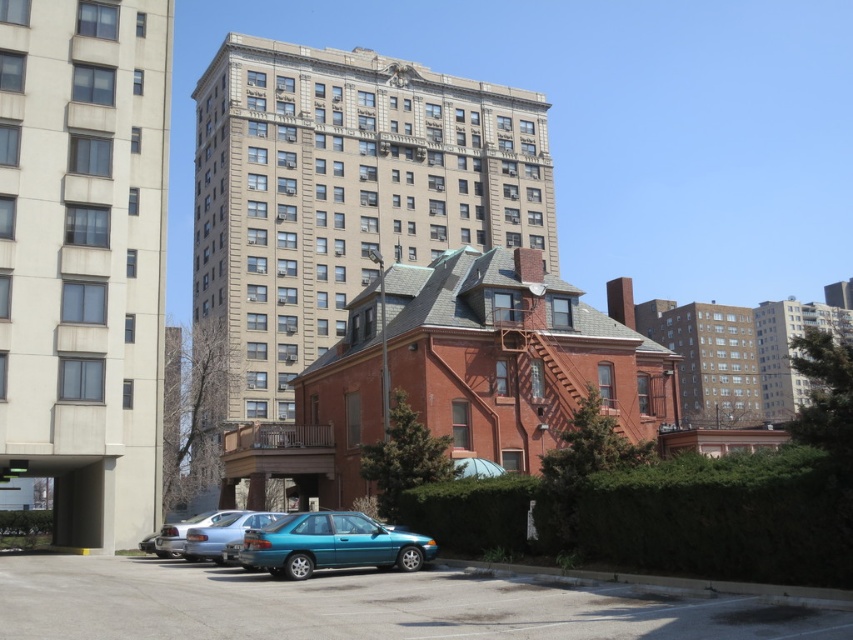
You are standing at the point marked by the coordinates point (x=331, y=545) in the image. What object are you directly facing?

The point (x=331, y=545) marks the teal glossy sedan at lower center, so you are directly facing the teal glossy sedan at lower center.